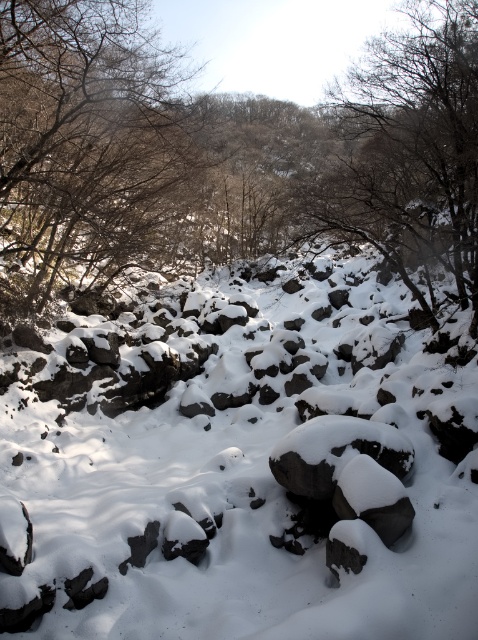
Does white matte snow at center appear under brown/dry wood at left?

Yes.

Does point (404, 570) come farther from viewer compared to point (80, 58)?

No.

Where is `white matte snow at center`? Image resolution: width=478 pixels, height=640 pixels. white matte snow at center is located at coordinates (241, 464).

The height and width of the screenshot is (640, 478). What do you see at coordinates (86, 144) in the screenshot?
I see `brown/dry wood at left` at bounding box center [86, 144].

Who is shorter, brown/dry wood at left or bare branches at upper right?

Standing shorter between the two is brown/dry wood at left.

This screenshot has width=478, height=640. What are the coordinates of `brown/dry wood at left` in the screenshot? It's located at (86, 144).

Does white matte snow at center have a greater width compared to bare branches at upper right?

Yes.

Is white matte snow at center positioned in front of bare branches at upper right?

Yes, white matte snow at center is closer to the viewer.

Who is more forward, [14,392] or [380,163]?

Point [14,392] is more forward.

Image resolution: width=478 pixels, height=640 pixels. Identify the location of white matte snow at center. [241, 464].